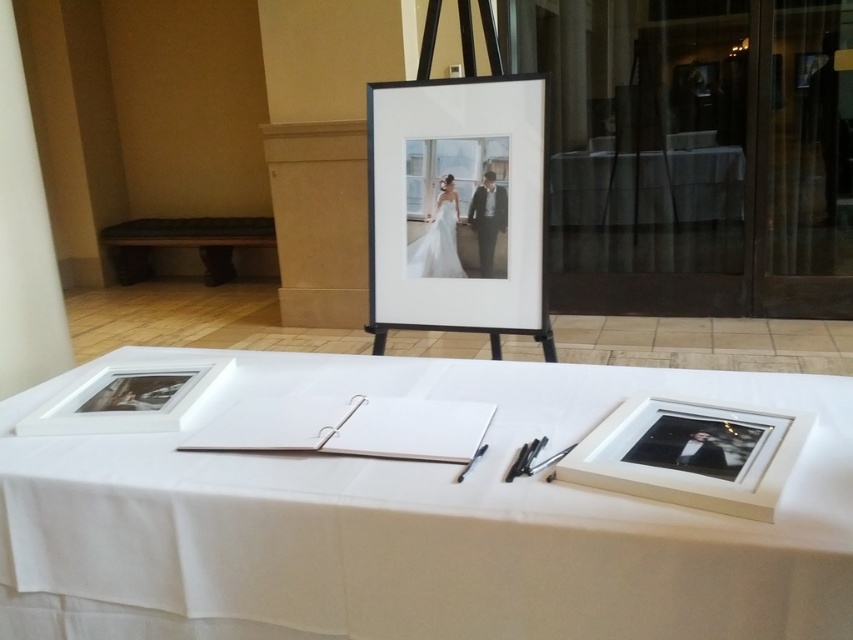
Looking at this image, you are an artist who wants to place a new framed artwork on the table. The new frame is the same size as the matte white frame at center. Will it fit on the table without overlapping the white paper at center?

The white paper at center is wider than the matte white frame at center. Since the new frame is the same size as the matte white frame, it will fit on the table without overlapping the white paper at center as long as it is placed appropriately.

You are a photographer organizing an exhibition. You need to place a new framed photo on the table covered with the white cloth at center. Where exactly should you place it to avoid overlapping the existing items?

The white cloth at center is located at point (646, 186), so place the new framed photo there to avoid overlapping existing items.

You are an artist who wants to place a new framed artwork on the table. The table has a white paper at center and a matte white frame at center. Which object has enough space to accommodate a larger framed artwork without overlapping?

The white paper at center is larger in size than the matte white frame at center, so placing the new framed artwork on the white paper at center would provide enough space without overlapping.